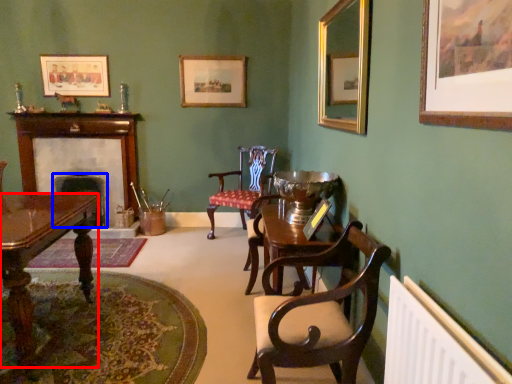
Question: Among these objects, which one is nearest to the camera, desk (highlighted by a red box) or fireplace (highlighted by a blue box)?

Choices:
 (A) desk
 (B) fireplace

Answer: (A)